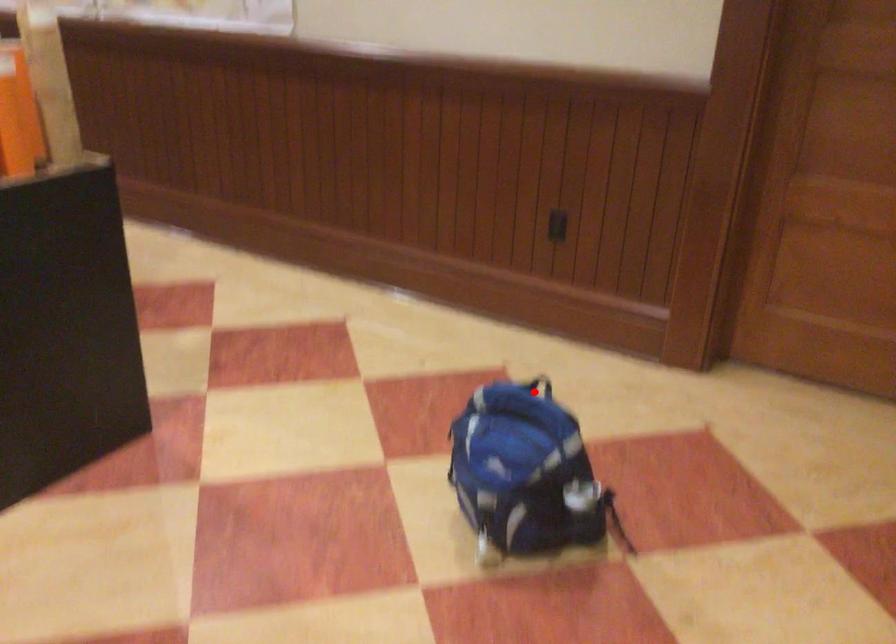
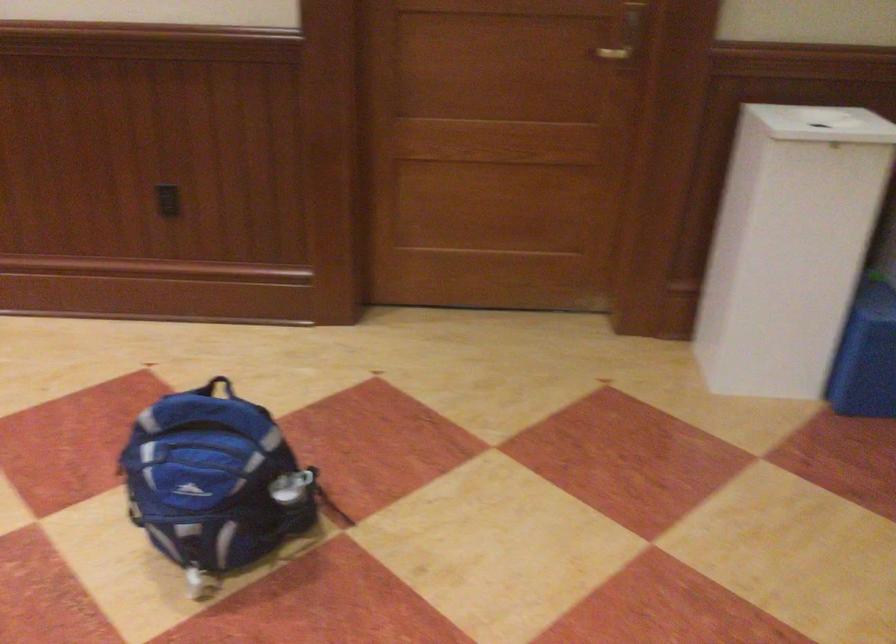
Question: I am providing you with two images of the same scene from different viewpoints. In image1, a red point is highlighted. Considering the same 3D point in image2, which of the following is correct?

Choices:
 (A) It is closer
 (B) It is farther

Answer: (A)